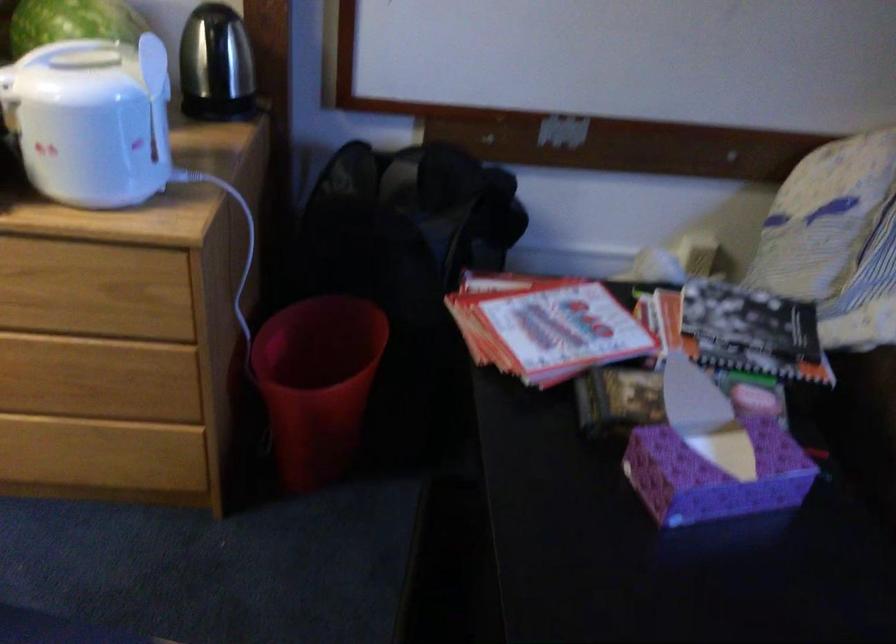
Locate an element on the screen. This screenshot has height=644, width=896. white rice spoon is located at coordinates (156, 97).